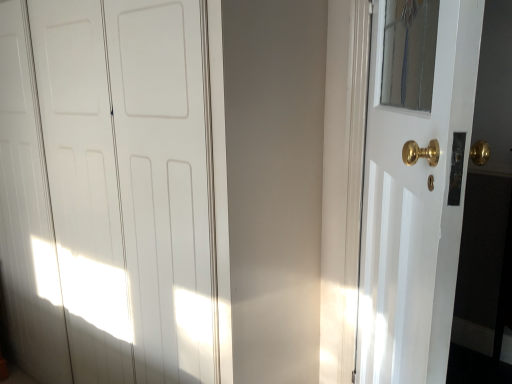
What do you see at coordinates (108, 191) in the screenshot?
I see `white glossy door at center, which is the second door from right to left` at bounding box center [108, 191].

The width and height of the screenshot is (512, 384). What are the coordinates of `white glossy door at center, which appears as the 1th door when viewed from the left` in the screenshot? It's located at (108, 191).

Measure the distance between white glossy door at center, which is the second door from right to left, and camera.

The distance of white glossy door at center, which is the second door from right to left, from camera is 3.73 feet.

Identify the location of white glossy door at right, which appears as the second door when viewed from the left. (415, 190).

Image resolution: width=512 pixels, height=384 pixels. What do you see at coordinates (415, 190) in the screenshot?
I see `white glossy door at right, which appears as the 1th door when viewed from the right` at bounding box center [415, 190].

The height and width of the screenshot is (384, 512). Find the location of `white glossy door at center, which appears as the 1th door when viewed from the left`. white glossy door at center, which appears as the 1th door when viewed from the left is located at coordinates tap(108, 191).

Is white glossy door at right, which appears as the 1th door when viewed from the right, to the right of white glossy door at center, which is the second door from right to left, from the viewer's perspective?

Yes.

Between white glossy door at right, which appears as the 1th door when viewed from the right, and white glossy door at center, which appears as the 1th door when viewed from the left, which one is positioned in front?

white glossy door at right, which appears as the 1th door when viewed from the right, is more forward.

Does point (440, 372) appear closer or farther from the camera than point (34, 266)?

Point (440, 372) is positioned closer to the camera compared to point (34, 266).

Based on the photo, from the image's perspective, does white glossy door at right, which appears as the second door when viewed from the left, appear higher than white glossy door at center, which appears as the 1th door when viewed from the left?

No, from the image's perspective, white glossy door at right, which appears as the second door when viewed from the left, is not over white glossy door at center, which appears as the 1th door when viewed from the left.

From a real-world perspective, between white glossy door at right, which appears as the 1th door when viewed from the right, and white glossy door at center, which is the second door from right to left, who is vertically higher?

white glossy door at right, which appears as the 1th door when viewed from the right.

Consider the image. Can you confirm if white glossy door at right, which appears as the second door when viewed from the left, is wider than white glossy door at center, which is the second door from right to left?

No.

Considering the relative sizes of white glossy door at right, which appears as the 1th door when viewed from the right, and white glossy door at center, which is the second door from right to left, in the image provided, is white glossy door at right, which appears as the 1th door when viewed from the right, shorter than white glossy door at center, which is the second door from right to left,?

Yes, white glossy door at right, which appears as the 1th door when viewed from the right, is shorter than white glossy door at center, which is the second door from right to left.

Is white glossy door at right, which appears as the second door when viewed from the left, smaller than white glossy door at center, which is the second door from right to left?

Yes.

Can white glossy door at center, which appears as the 1th door when viewed from the left, be found inside white glossy door at right, which appears as the 1th door when viewed from the right?

No.

Is white glossy door at right, which appears as the 1th door when viewed from the right, beside white glossy door at center, which is the second door from right to left?

No, white glossy door at right, which appears as the 1th door when viewed from the right, is not in contact with white glossy door at center, which is the second door from right to left.

Is white glossy door at right, which appears as the 1th door when viewed from the right, oriented away from white glossy door at center, which appears as the 1th door when viewed from the left?

Yes, white glossy door at center, which appears as the 1th door when viewed from the left, is at the back of white glossy door at right, which appears as the 1th door when viewed from the right.

Locate an element on the screen. The image size is (512, 384). door below the white glossy door at right, which appears as the second door when viewed from the left (from a real-world perspective) is located at coordinates (108, 191).

Considering the relative positions of white glossy door at center, which is the second door from right to left, and white glossy door at right, which appears as the 1th door when viewed from the right, in the image provided, is white glossy door at center, which is the second door from right to left, to the left of white glossy door at right, which appears as the 1th door when viewed from the right, from the viewer's perspective?

Yes, white glossy door at center, which is the second door from right to left, is to the left of white glossy door at right, which appears as the 1th door when viewed from the right.

Between white glossy door at center, which appears as the 1th door when viewed from the left, and white glossy door at right, which appears as the second door when viewed from the left, which one is positioned in front?

white glossy door at right, which appears as the second door when viewed from the left.

Which is behind, point (135, 281) or point (426, 293)?

The point (135, 281) is behind.

From the image's perspective, which one is positioned lower, white glossy door at center, which is the second door from right to left, or white glossy door at right, which appears as the 1th door when viewed from the right?

white glossy door at right, which appears as the 1th door when viewed from the right, is shown below in the image.

From a real-world perspective, is white glossy door at center, which appears as the 1th door when viewed from the left, located higher than white glossy door at right, which appears as the second door when viewed from the left?

Actually, white glossy door at center, which appears as the 1th door when viewed from the left, is physically below white glossy door at right, which appears as the second door when viewed from the left, in the real world.

Does white glossy door at center, which is the second door from right to left, have a lesser width compared to white glossy door at right, which appears as the second door when viewed from the left?

Incorrect, the width of white glossy door at center, which is the second door from right to left, is not less than that of white glossy door at right, which appears as the second door when viewed from the left.

Who is taller, white glossy door at center, which appears as the 1th door when viewed from the left, or white glossy door at right, which appears as the 1th door when viewed from the right?

white glossy door at center, which appears as the 1th door when viewed from the left, is taller.

Is white glossy door at center, which appears as the 1th door when viewed from the left, bigger than white glossy door at right, which appears as the 1th door when viewed from the right?

Indeed, white glossy door at center, which appears as the 1th door when viewed from the left, has a larger size compared to white glossy door at right, which appears as the 1th door when viewed from the right.

Is white glossy door at center, which appears as the 1th door when viewed from the left, surrounding white glossy door at right, which appears as the second door when viewed from the left?

No, white glossy door at right, which appears as the second door when viewed from the left, is not a part of white glossy door at center, which appears as the 1th door when viewed from the left.

Is the surface of white glossy door at center, which is the second door from right to left, in direct contact with white glossy door at right, which appears as the second door when viewed from the left?

No, white glossy door at center, which is the second door from right to left, is not beside white glossy door at right, which appears as the second door when viewed from the left.

Is white glossy door at center, which is the second door from right to left, oriented towards white glossy door at right, which appears as the second door when viewed from the left?

No, white glossy door at center, which is the second door from right to left, is not aimed at white glossy door at right, which appears as the second door when viewed from the left.

How much distance is there between white glossy door at center, which is the second door from right to left, and white glossy door at right, which appears as the 1th door when viewed from the right?

The distance of white glossy door at center, which is the second door from right to left, from white glossy door at right, which appears as the 1th door when viewed from the right, is 31.91 inches.

Locate an element on the screen. Image resolution: width=512 pixels, height=384 pixels. door above the white glossy door at center, which is the second door from right to left (from a real-world perspective) is located at coordinates (415, 190).

In order to click on door that is on the left side of white glossy door at right, which appears as the 1th door when viewed from the right in this screenshot , I will do `click(108, 191)`.

This screenshot has width=512, height=384. In order to click on door lying above the white glossy door at right, which appears as the 1th door when viewed from the right (from the image's perspective) in this screenshot , I will do `click(108, 191)`.